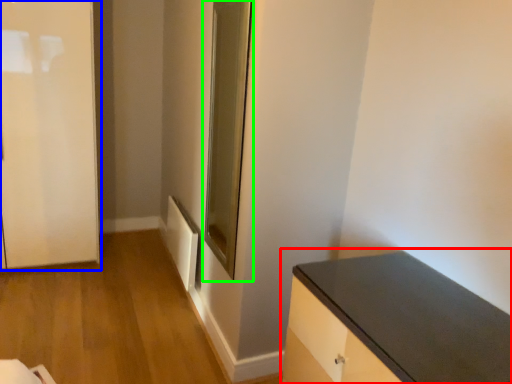
Question: Which object is the closest to the countertop (highlighted by a red box)? Choose among these: door (highlighted by a blue box) or glass door (highlighted by a green box).

Choices:
 (A) door
 (B) glass door

Answer: (B)